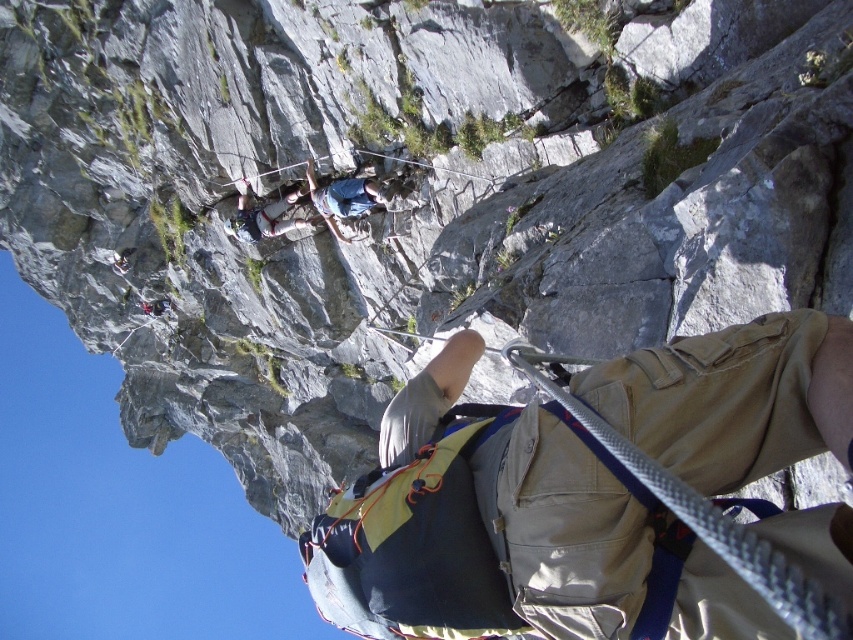
Is tan fabric backpack at center to the left of blue fabric shirt at upper center from the viewer's perspective?

Incorrect, tan fabric backpack at center is not on the left side of blue fabric shirt at upper center.

Is tan fabric backpack at center bigger than blue fabric shirt at upper center?

Yes, tan fabric backpack at center is bigger than blue fabric shirt at upper center.

Between point (379, 563) and point (367, 195), which one is positioned behind?

Point (367, 195)

I want to click on tan fabric backpack at center, so click(x=511, y=532).